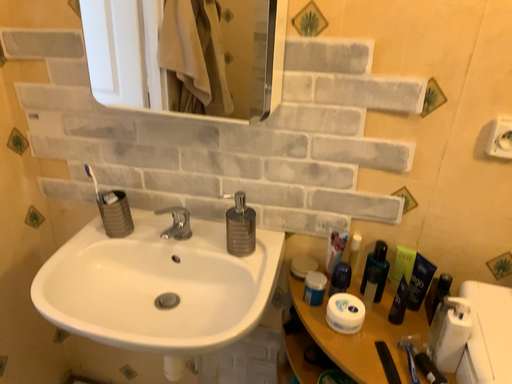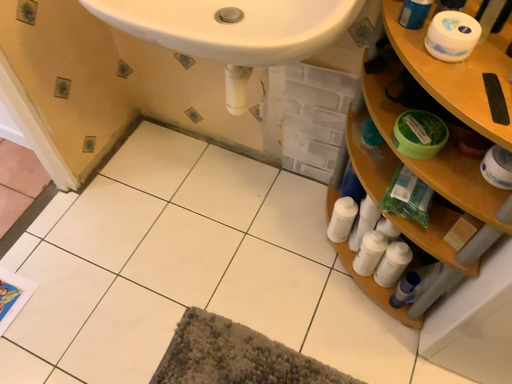
Question: How did the camera likely rotate when shooting the video?

Choices:
 (A) rotated upward
 (B) rotated downward

Answer: (B)